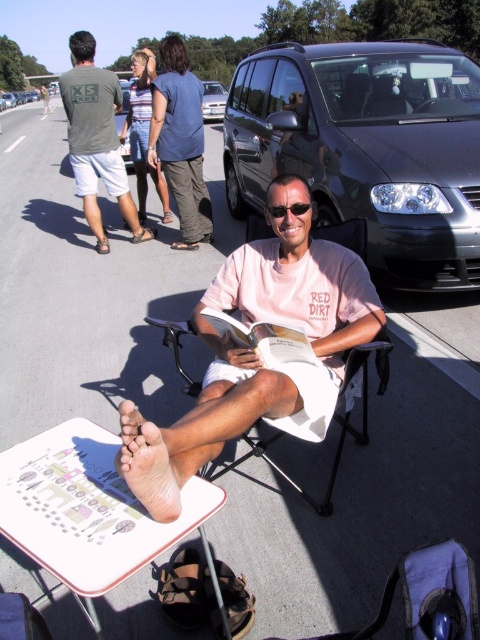
Who is more distant from viewer, (184, 390) or (216, 88)?

Point (216, 88)

Between white plastic chair at center and silver metallic van at upper center, which one appears on the left side from the viewer's perspective?

From the viewer's perspective, silver metallic van at upper center appears more on the left side.

This screenshot has width=480, height=640. I want to click on white plastic chair at center, so click(177, 348).

Is the position of pink cotton shirt at center more distant than that of matte green t-shirt at upper left?

No, pink cotton shirt at center is closer to the viewer.

Is pink cotton shirt at center taller than matte green t-shirt at upper left?

No.

Who is more forward, [333,397] or [72,81]?

Point [333,397]

At what (x,y) coordinates should I click in order to perform the action: click on pink cotton shirt at center. Please return your answer as a coordinate pair (x, y). The image size is (480, 640). Looking at the image, I should click on tap(256, 355).

This screenshot has height=640, width=480. What do you see at coordinates (96, 138) in the screenshot?
I see `matte green t-shirt at upper left` at bounding box center [96, 138].

Where is `matte green t-shirt at upper left`? matte green t-shirt at upper left is located at coordinates (96, 138).